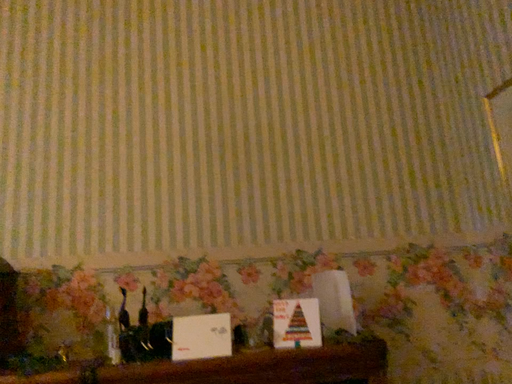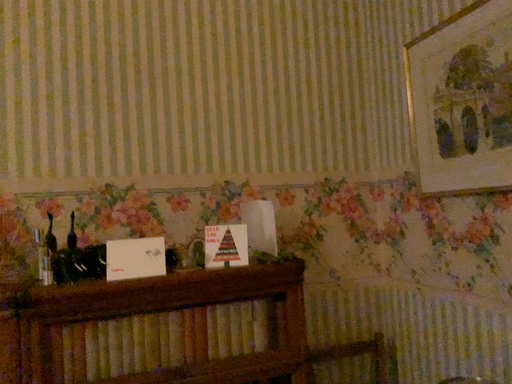
Question: Which way did the camera rotate in the video?

Choices:
 (A) rotated right
 (B) rotated left

Answer: (A)